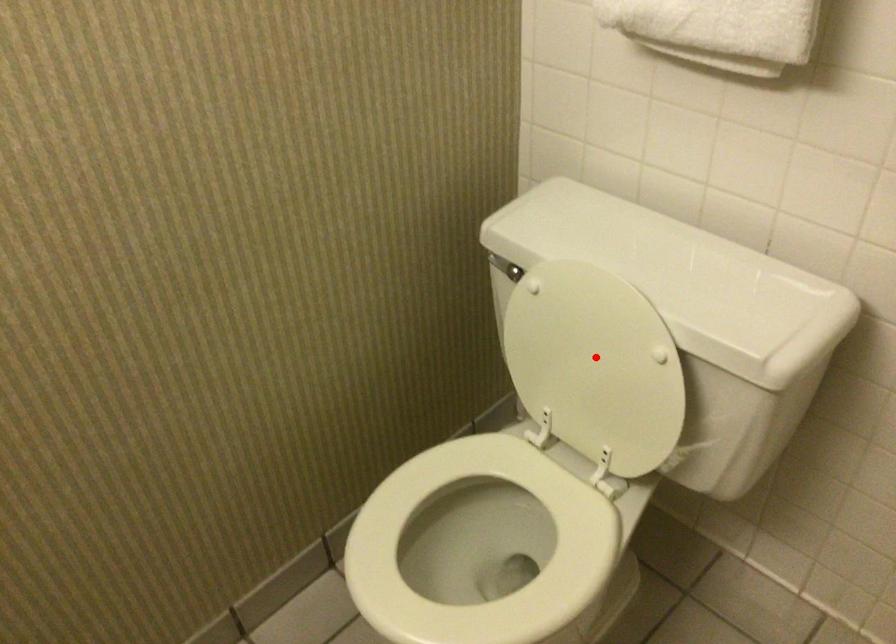
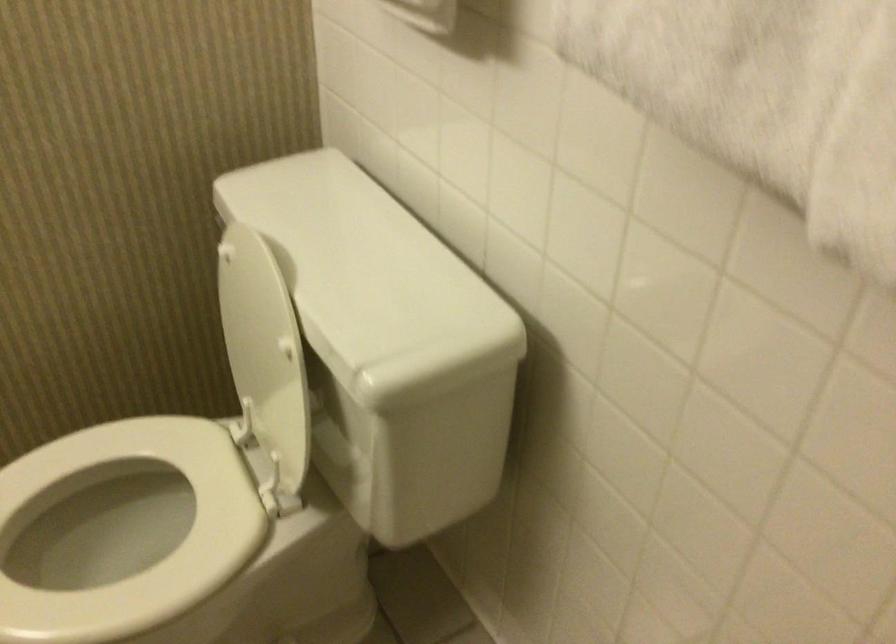
Where in the second image is the point corresponding to the highlighted location from the first image?

(259, 343)